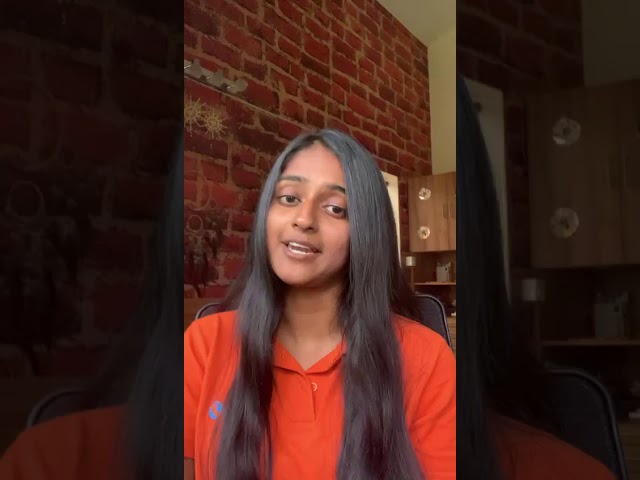
Image resolution: width=640 pixels, height=480 pixels. Identify the location of back of chair. (438, 316).